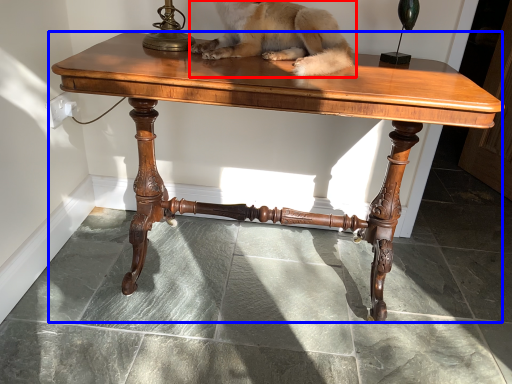
Question: Which object appears closest to the camera in this image, dog (highlighted by a red box) or table (highlighted by a blue box)?

Choices:
 (A) dog
 (B) table

Answer: (B)